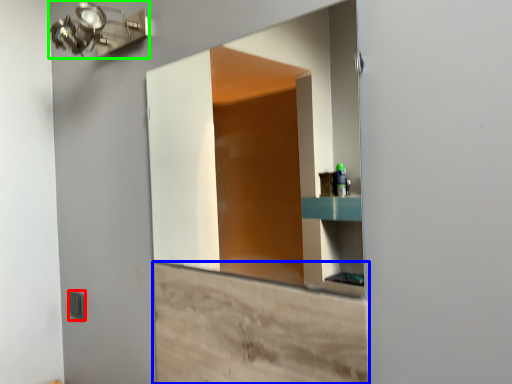
Question: Which object is positioned farthest from light switch (highlighted by a red box)? Select from cabinetry (highlighted by a blue box) and light fixture (highlighted by a green box).

Choices:
 (A) cabinetry
 (B) light fixture

Answer: (B)